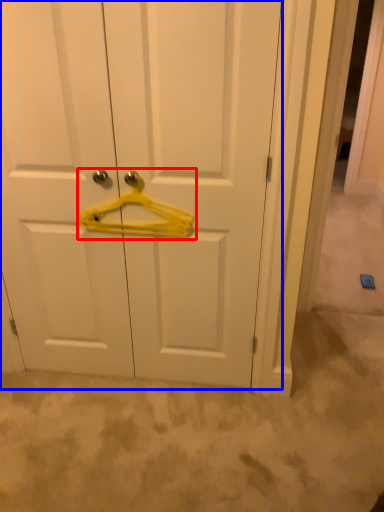
Question: Which object is closer to the camera taking this photo, hanger (highlighted by a red box) or door (highlighted by a blue box)?

Choices:
 (A) hanger
 (B) door

Answer: (B)